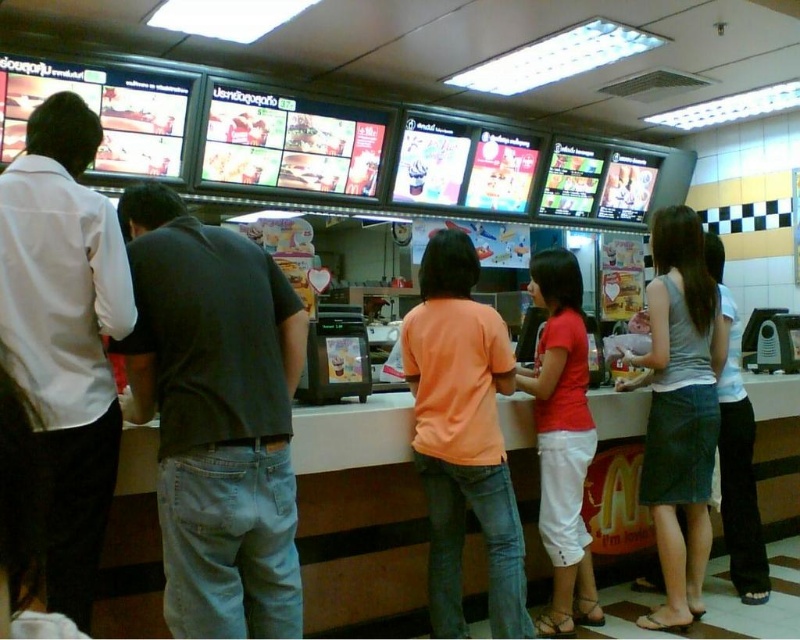
Question: Does dark gray jeans at center appear on the left side of denim skirt at center?

Choices:
 (A) yes
 (B) no

Answer: (A)

Question: Is white shirt at left positioned behind denim skirt at center?

Choices:
 (A) yes
 (B) no

Answer: (B)

Question: Which point appears farthest from the camera in this image?

Choices:
 (A) (68, 616)
 (B) (680, 244)

Answer: (B)

Question: Does white shirt at left appear on the right side of denim skirt at center?

Choices:
 (A) yes
 (B) no

Answer: (B)

Question: Which of the following is the farthest from the observer?

Choices:
 (A) denim skirt at center
 (B) white shirt at left

Answer: (A)

Question: Which point is closer to the camera?

Choices:
 (A) (554, 410)
 (B) (648, 452)
 (C) (164, 541)
 (D) (428, 392)

Answer: (C)